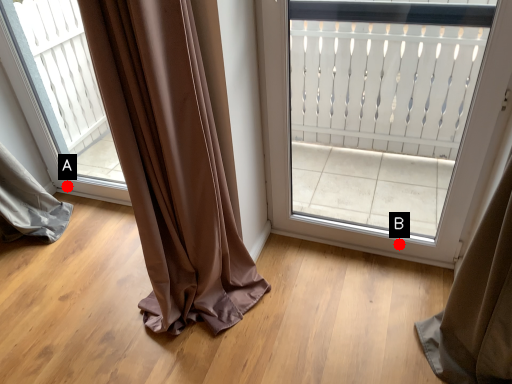
Question: Two points are circled on the image, labeled by A and B beside each circle. Which of the following is the farthest from the observer?

Choices:
 (A) A is further
 (B) B is further

Answer: (A)